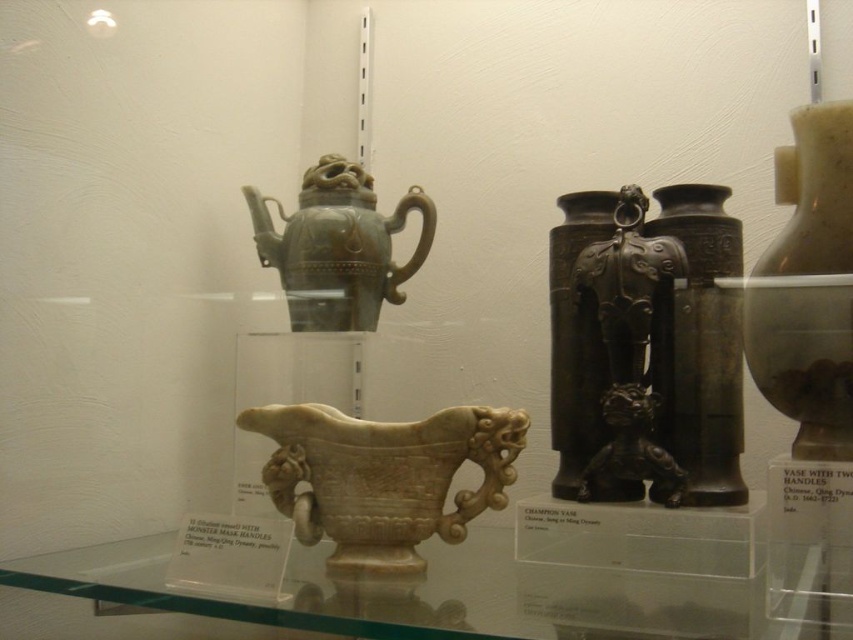
Question: Which point appears farthest from the camera in this image?

Choices:
 (A) (802, 216)
 (B) (604, 461)
 (C) (347, 536)
 (D) (682, 417)

Answer: (D)

Question: Does green jade teapot at center have a larger size compared to black polished stone lion at center?

Choices:
 (A) yes
 (B) no

Answer: (A)

Question: Does bronze elephant at center have a larger size compared to green jade teapot at center?

Choices:
 (A) yes
 (B) no

Answer: (A)

Question: In this image, where is bronze elephant at center located relative to matte brown vase at upper right?

Choices:
 (A) left
 (B) right

Answer: (A)

Question: Estimate the real-world distances between objects in this image. Which object is farther from the green jade teapot at center?

Choices:
 (A) transparent glass table at center
 (B) black polished stone lion at center
 (C) matte brown vase at upper right

Answer: (C)

Question: Which object appears farthest from the camera in this image?

Choices:
 (A) transparent glass table at center
 (B) green jade teapot at center
 (C) bronze elephant at center
 (D) bronze textured vase at center

Answer: (B)